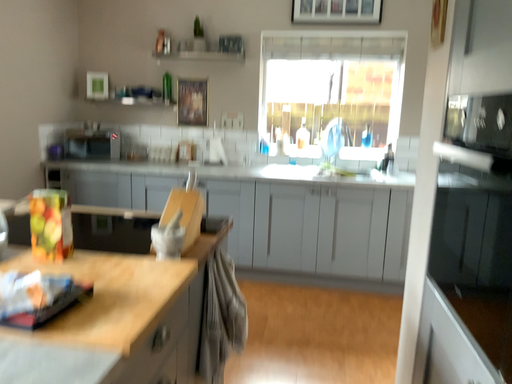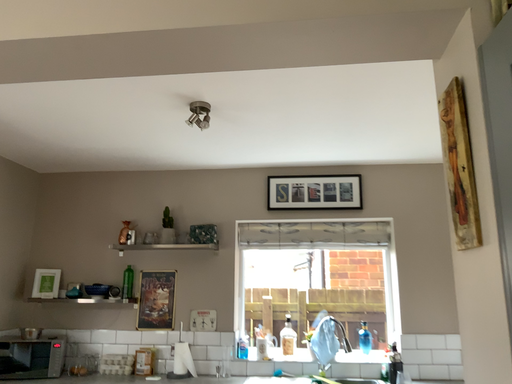
Question: Which way did the camera rotate in the video?

Choices:
 (A) rotated downward
 (B) rotated upward

Answer: (B)